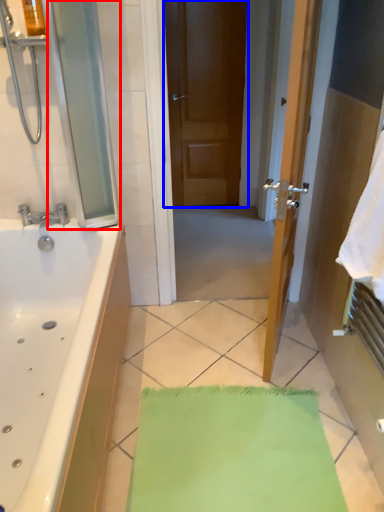
Question: Which object appears farthest to the camera in this image, screen door (highlighted by a red box) or door (highlighted by a blue box)?

Choices:
 (A) screen door
 (B) door

Answer: (B)